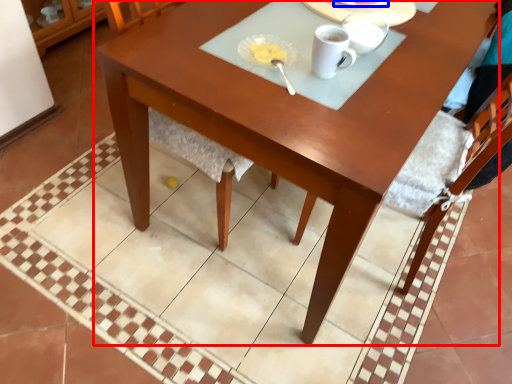
Question: Among these objects, which one is farthest to the camera, desk (highlighted by a red box) or tableware (highlighted by a blue box)?

Choices:
 (A) desk
 (B) tableware

Answer: (B)